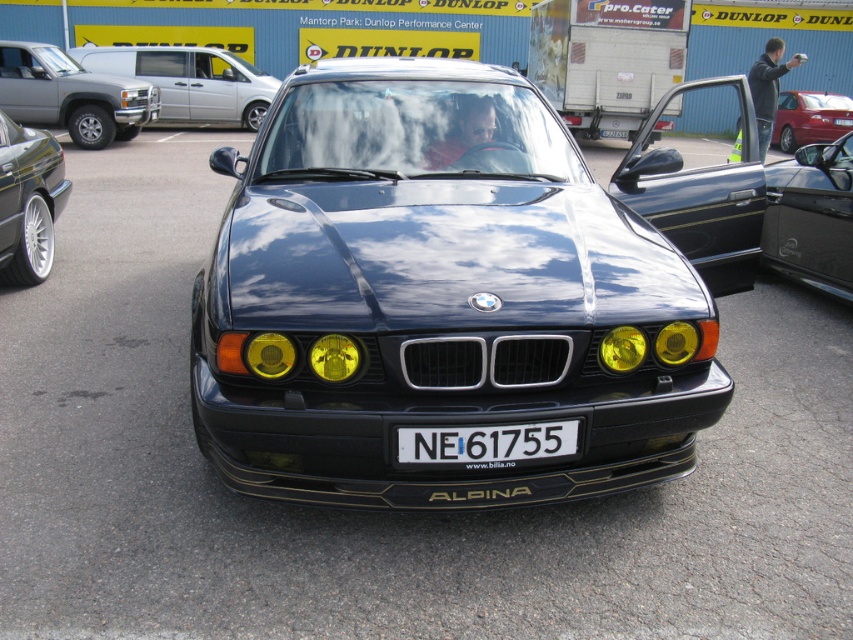
Is point (410, 483) farther from camera compared to point (793, 120)?

No, (410, 483) is closer to viewer.

Between point (345, 269) and point (837, 129), which one is positioned behind?

The point (837, 129) is behind.

Who is more forward, [381,193] or [788,147]?

Point [381,193] is more forward.

The image size is (853, 640). What are the coordinates of `glossy black car at center` in the screenshot? It's located at (444, 298).

Which is below, silver metallic suv at upper left or yellow matte headlight at center?

yellow matte headlight at center is below.

Who is more distant from viewer, (15, 65) or (352, 371)?

Point (15, 65)

Is point (73, 99) positioned before point (350, 362)?

That is False.

Identify the location of silver metallic suv at upper left. The width and height of the screenshot is (853, 640). (71, 96).

Is glossy black car at center taller than yellow matte headlight at center?

Yes.

This screenshot has height=640, width=853. What do you see at coordinates (444, 298) in the screenshot?
I see `glossy black car at center` at bounding box center [444, 298].

Locate an element on the screen. Image resolution: width=853 pixels, height=640 pixels. glossy black car at center is located at coordinates (444, 298).